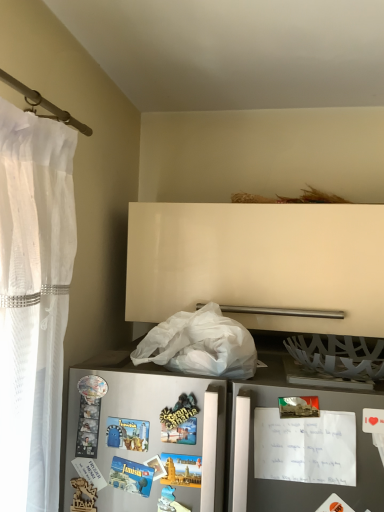
Measure the distance between metallic postcard at right and camera.

A distance of 89.19 centimeters exists between metallic postcard at right and camera.

Locate an element on the screen. The image size is (384, 512). white matte plastic bag at lower center is located at coordinates (200, 345).

Considering the sizes of objects metallic postcard at right and metallic gray refrigerator at lower left in the image provided, who is thinner, metallic postcard at right or metallic gray refrigerator at lower left?

metallic gray refrigerator at lower left is thinner.

Is metallic postcard at right far away from metallic gray refrigerator at lower left?

metallic postcard at right is near metallic gray refrigerator at lower left, not far away.

Considering the positions of objects metallic postcard at right and metallic gray refrigerator at lower left in the image provided, who is more to the right, metallic postcard at right or metallic gray refrigerator at lower left?

Positioned to the right is metallic postcard at right.

Could you tell me if metallic postcard at right is facing metallic gray refrigerator at lower left?

Yes, metallic postcard at right faces towards metallic gray refrigerator at lower left.

How distant is white matte plastic bag at lower center from metallic postcard at right?

They are 8.86 inches apart.

From the image's perspective, is white matte plastic bag at lower center located beneath metallic postcard at right?

Actually, white matte plastic bag at lower center appears above metallic postcard at right in the image.

You are a GUI agent. You are given a task and a screenshot of the screen. Output one action in this format:
    pyautogui.click(x=<x>, y=<y>)
    Task: Click on the plastic bag lying above the metallic postcard at right (from the image's perspective)
    The height and width of the screenshot is (512, 384).
    Given the screenshot: What is the action you would take?
    pyautogui.click(x=200, y=345)

In terms of size, does white matte plastic bag at lower center appear bigger or smaller than metallic postcard at right?

white matte plastic bag at lower center is bigger than metallic postcard at right.

From the image's perspective, relative to metallic gray refrigerator at lower left, is white matte plastic bag at lower center above or below?

Clearly, from the image's perspective, white matte plastic bag at lower center is above metallic gray refrigerator at lower left.

Which is more to the right, white matte plastic bag at lower center or metallic gray refrigerator at lower left?

From the viewer's perspective, metallic gray refrigerator at lower left appears more on the right side.

Would you say white matte plastic bag at lower center is outside metallic gray refrigerator at lower left?

Indeed, white matte plastic bag at lower center is completely outside metallic gray refrigerator at lower left.

You are a GUI agent. You are given a task and a screenshot of the screen. Output one action in this format:
    pyautogui.click(x=<x>, y=<y>)
    Task: Click on the plastic bag on the left of metallic gray refrigerator at lower left
    This screenshot has height=512, width=384.
    Given the screenshot: What is the action you would take?
    pyautogui.click(x=200, y=345)

The height and width of the screenshot is (512, 384). Identify the location of plastic bag above the metallic gray refrigerator at lower left (from the image's perspective). (200, 345).

Visually, is metallic gray refrigerator at lower left positioned to the left or to the right of white matte plastic bag at lower center?

Clearly, metallic gray refrigerator at lower left is on the right of white matte plastic bag at lower center in the image.

Is metallic gray refrigerator at lower left bigger than white matte plastic bag at lower center?

No, metallic gray refrigerator at lower left is not bigger than white matte plastic bag at lower center.

From a real-world perspective, which object stands above the other?

white matte plastic bag at lower center.

Does metallic gray refrigerator at lower left appear on the left side of metallic postcard at right?

Correct, you'll find metallic gray refrigerator at lower left to the left of metallic postcard at right.

Which point is more distant from viewer, (x=201, y=449) or (x=333, y=470)?

The point (x=201, y=449) is behind.

From a real-world perspective, does metallic gray refrigerator at lower left sit lower than metallic postcard at right?

Yes, from a real-world perspective, metallic gray refrigerator at lower left is under metallic postcard at right.

Is metallic gray refrigerator at lower left positioned before metallic postcard at right?

Yes, it is in front of metallic postcard at right.

Does metallic postcard at right lie in front of white matte plastic bag at lower center?

Yes, metallic postcard at right is closer to the viewer.

In the scene shown: From the image's perspective, does metallic postcard at right appear higher than white matte plastic bag at lower center?

No, from the image's perspective, metallic postcard at right is not above white matte plastic bag at lower center.

Is metallic postcard at right inside the boundaries of white matte plastic bag at lower center, or outside?

The correct answer is: outside.

Between metallic postcard at right and white matte plastic bag at lower center, which one appears on the left side from the viewer's perspective?

From the viewer's perspective, white matte plastic bag at lower center appears more on the left side.

You are a GUI agent. You are given a task and a screenshot of the screen. Output one action in this format:
    pyautogui.click(x=<x>, y=<y>)
    Task: Click on the postcard behind the metallic gray refrigerator at lower left
    
    Given the screenshot: What is the action you would take?
    pyautogui.click(x=305, y=447)

Locate an element on the screen. This screenshot has height=512, width=384. plastic bag to the left of metallic postcard at right is located at coordinates (200, 345).

From the image, which object appears to be nearer to white matte plastic bag at lower center, metallic postcard at right or metallic gray refrigerator at lower left?

metallic gray refrigerator at lower left is closer to white matte plastic bag at lower center.

Considering their positions, is metallic postcard at right positioned closer to metallic gray refrigerator at lower left than white matte plastic bag at lower center?

metallic postcard at right is closer to metallic gray refrigerator at lower left.

Based on their spatial positions, is metallic gray refrigerator at lower left or metallic postcard at right further from white matte plastic bag at lower center?

The object further to white matte plastic bag at lower center is metallic postcard at right.

Estimate the real-world distances between objects in this image. Which object is further from metallic postcard at right, white matte plastic bag at lower center or metallic gray refrigerator at lower left?

white matte plastic bag at lower center is further to metallic postcard at right.

Based on the photo, when comparing their distances from metallic postcard at right, does metallic gray refrigerator at lower left or white matte plastic bag at lower center seem further?

white matte plastic bag at lower center lies further to metallic postcard at right than the other object.

Considering their positions, is white matte plastic bag at lower center positioned further to metallic gray refrigerator at lower left than metallic postcard at right?

white matte plastic bag at lower center is positioned further to the anchor metallic gray refrigerator at lower left.

The height and width of the screenshot is (512, 384). In order to click on postcard between white matte plastic bag at lower center and metallic gray refrigerator at lower left vertically in this screenshot , I will do `click(305, 447)`.